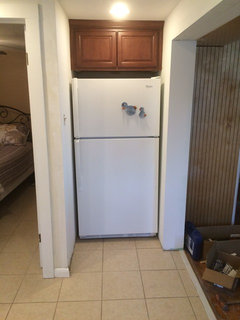
Where is `door`? The width and height of the screenshot is (240, 320). door is located at coordinates (36, 191).